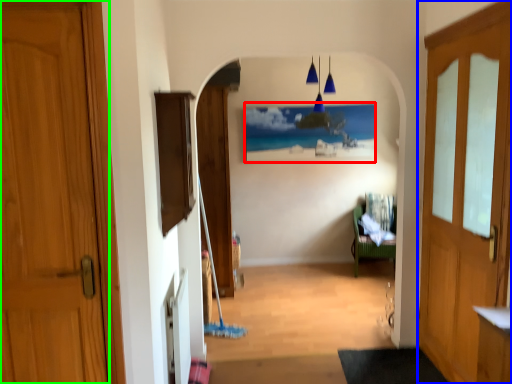
Question: Which object is the closest to the picture frame (highlighted by a red box)? Choose among these: door (highlighted by a blue box) or door (highlighted by a green box).

Choices:
 (A) door
 (B) door

Answer: (A)